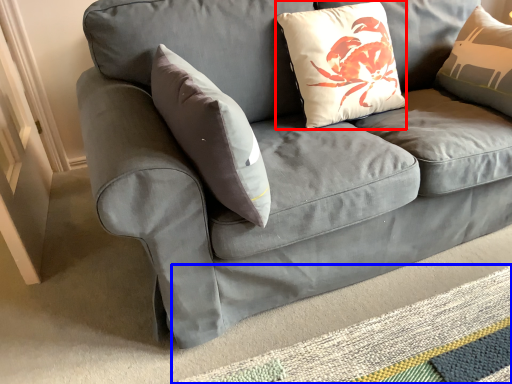
Question: Which of the following is the closest to the observer, pillow (highlighted by a red box) or mat (highlighted by a blue box)?

Choices:
 (A) pillow
 (B) mat

Answer: (B)